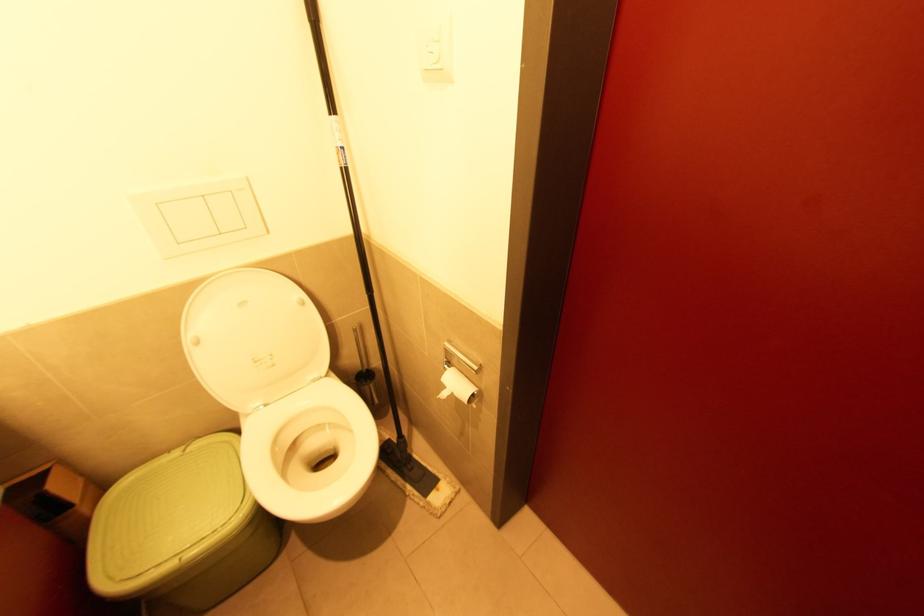
Find the location of `green bin lid`. green bin lid is located at coordinates (165, 515).